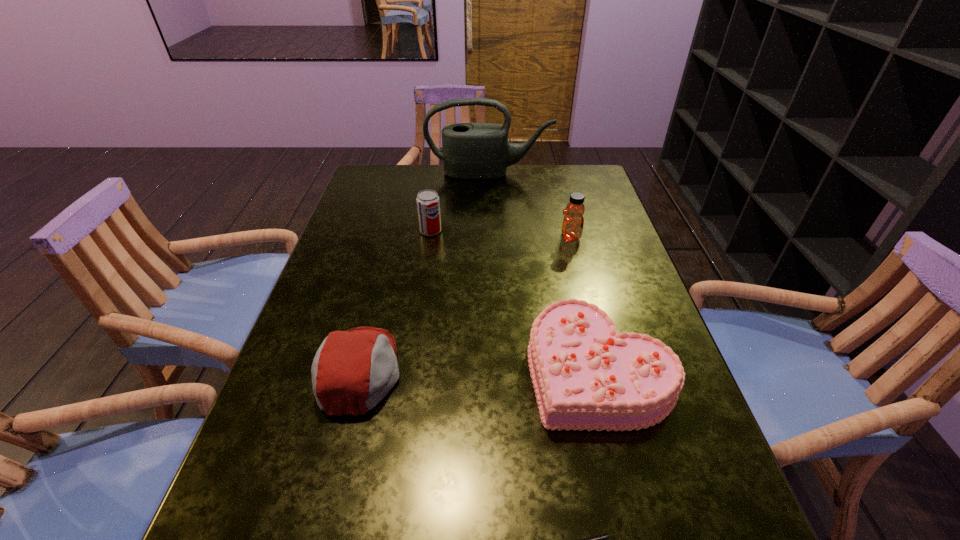
Where is `free spot between the cake and the cap`? free spot between the cake and the cap is located at coordinates (479, 370).

Identify which object is located as the fifth nearest to the farthest object. Please provide its 2D coordinates. Your answer should be formatted as a tuple, i.e. [(x, y)], where the tuple contains the x and y coordinates of a point satisfying the conditions above.

[(602, 539)]

I want to click on object that stands as the second closest to the cake, so click(x=353, y=370).